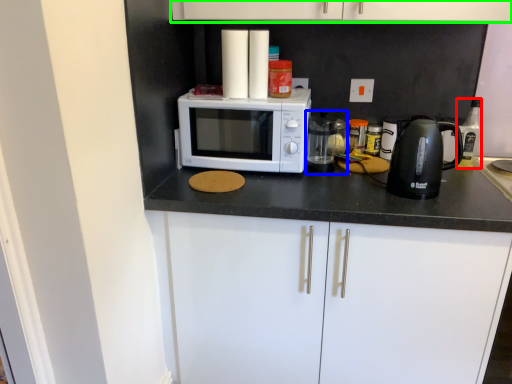
Question: Considering the real-world distances, which object is farthest from bottle (highlighted by a red box)? appliance (highlighted by a blue box) or cabinetry (highlighted by a green box)?

Choices:
 (A) appliance
 (B) cabinetry

Answer: (B)